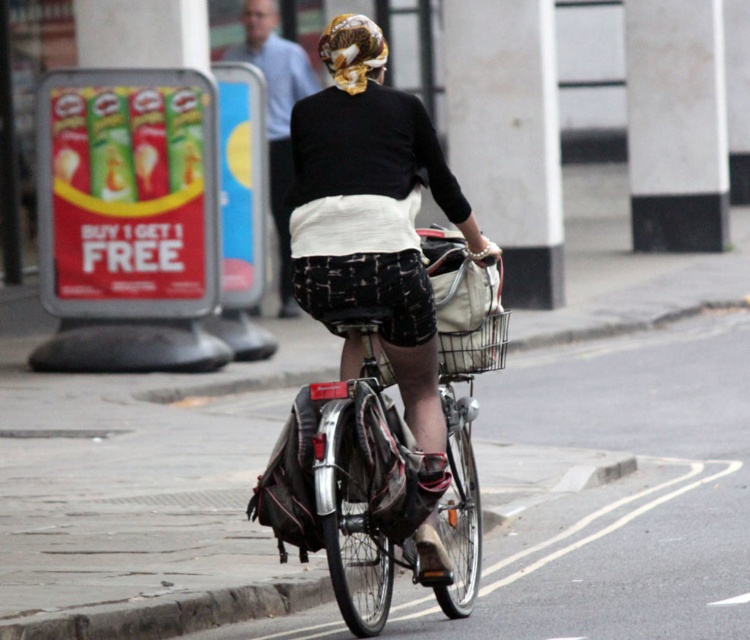
Is matte black shorts at center wider than gold-patterned fabric helmet at upper center?

No, matte black shorts at center is not wider than gold-patterned fabric helmet at upper center.

Who is higher up, matte black shorts at center or gold-patterned fabric helmet at upper center?

gold-patterned fabric helmet at upper center is higher up.

Is point (330, 259) positioned before point (360, 49)?

Yes, point (330, 259) is in front of point (360, 49).

Find the location of `matte black shorts at center`. matte black shorts at center is located at coordinates point(381,256).

How distant is matte black shorts at center from metallic silver basket at center?

matte black shorts at center is 18.94 inches away from metallic silver basket at center.

Between matte black shorts at center and metallic silver basket at center, which one has less height?

metallic silver basket at center is shorter.

Does point (417, 444) come in front of point (464, 349)?

Yes, it is in front of point (464, 349).

This screenshot has height=640, width=750. I want to click on matte black shorts at center, so click(381, 256).

Between gold-patterned fabric helmet at upper center and metallic silver basket at center, which one appears on the right side from the viewer's perspective?

From the viewer's perspective, metallic silver basket at center appears more on the right side.

Is gold-patterned fabric helmet at upper center taller than metallic silver basket at center?

Yes.

Identify the location of gold-patterned fabric helmet at upper center. (352, 51).